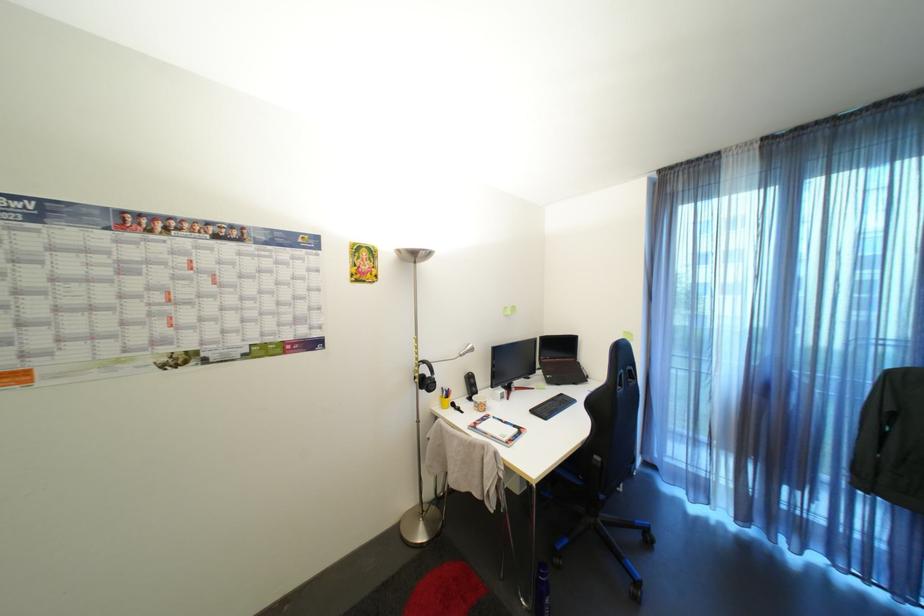
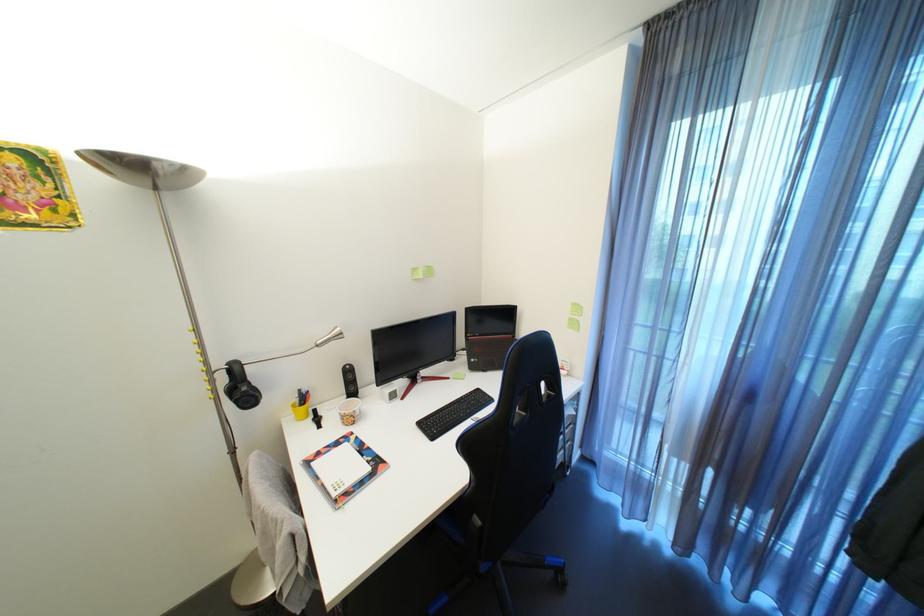
Which direction would the cameraman need to move to produce the second image?

The cameraman walked toward right, forward.